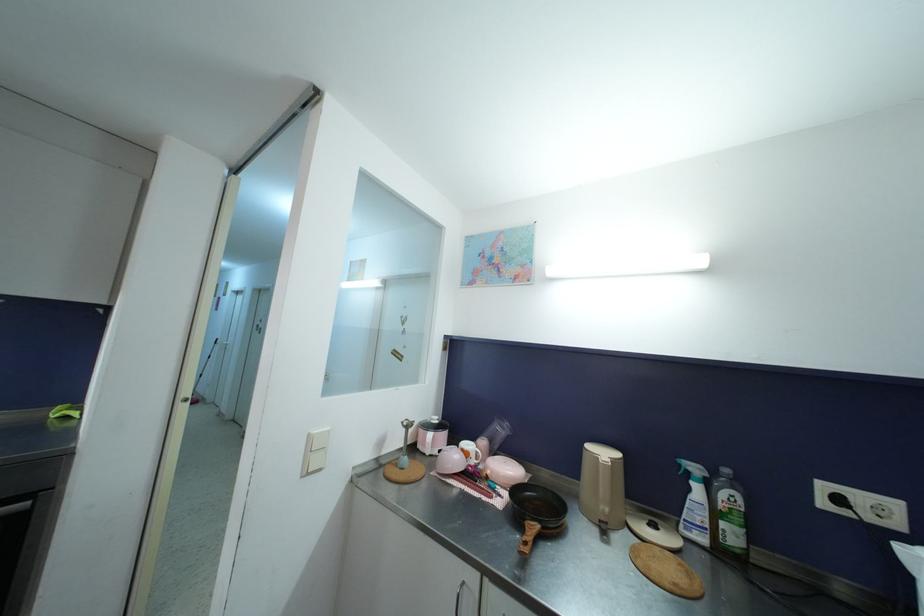
The width and height of the screenshot is (924, 616). Find the location of `beige electric kettle`. beige electric kettle is located at coordinates (602, 485).